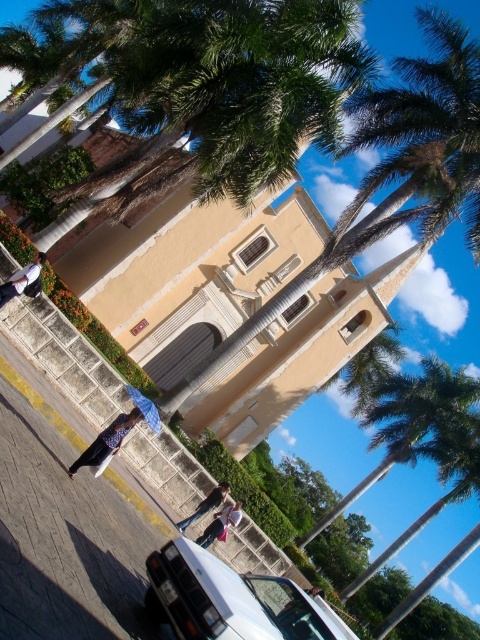
Can you confirm if denim jacket at lower left is positioned to the left of denim jacket at lower center?

Correct, you'll find denim jacket at lower left to the left of denim jacket at lower center.

Is point (19, 269) positioned behind point (230, 513)?

No, (19, 269) is in front of (230, 513).

Does point (40, 266) come closer to viewer compared to point (238, 516)?

Yes, point (40, 266) is in front of point (238, 516).

Locate an element on the screen. denim jacket at lower left is located at coordinates (23, 280).

How distant is denim jacket at lower center from dark blue jeans at lower center?

denim jacket at lower center is 9.32 feet from dark blue jeans at lower center.

Is the position of denim jacket at lower center more distant than that of dark blue jeans at lower center?

That is False.

Is point (219, 522) less distant than point (181, 531)?

Yes, it is.

The height and width of the screenshot is (640, 480). Identify the location of denim jacket at lower center. (220, 524).

Can you confirm if leather jacket at lower left is taller than denim jacket at lower center?

Correct, leather jacket at lower left is much taller as denim jacket at lower center.

Can you confirm if leather jacket at lower left is shorter than denim jacket at lower center?

In fact, leather jacket at lower left may be taller than denim jacket at lower center.

Is point (94, 451) less distant than point (220, 518)?

That is True.

I want to click on leather jacket at lower left, so click(x=107, y=440).